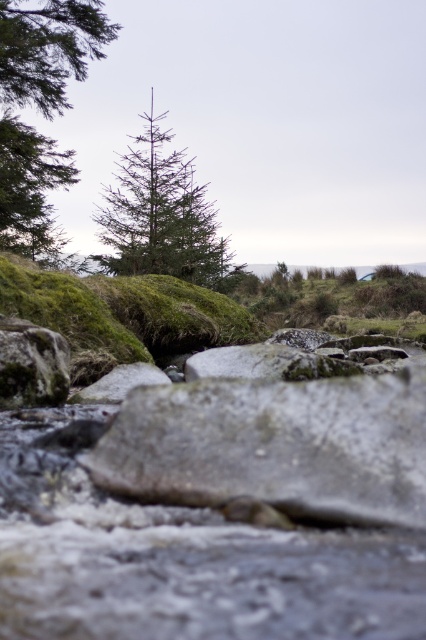
Question: Which object is the closest to the green matte tree at upper left?

Choices:
 (A) green matte tree at center
 (B) gray rough rock at lower left

Answer: (A)

Question: Does green matte tree at center appear under gray rough rock at lower left?

Choices:
 (A) yes
 (B) no

Answer: (B)

Question: Which is farther from the green matte tree at center?

Choices:
 (A) gray rough rock at lower left
 (B) green matte tree at upper left

Answer: (A)

Question: Is green matte tree at upper left to the right of gray rough rock at lower left from the viewer's perspective?

Choices:
 (A) yes
 (B) no

Answer: (B)

Question: Can you confirm if gray rough boulder at center is positioned to the right of green matte tree at upper left?

Choices:
 (A) yes
 (B) no

Answer: (A)

Question: Which point is farther to the camera?

Choices:
 (A) gray rough boulder at center
 (B) gray rough rock at lower left

Answer: (B)